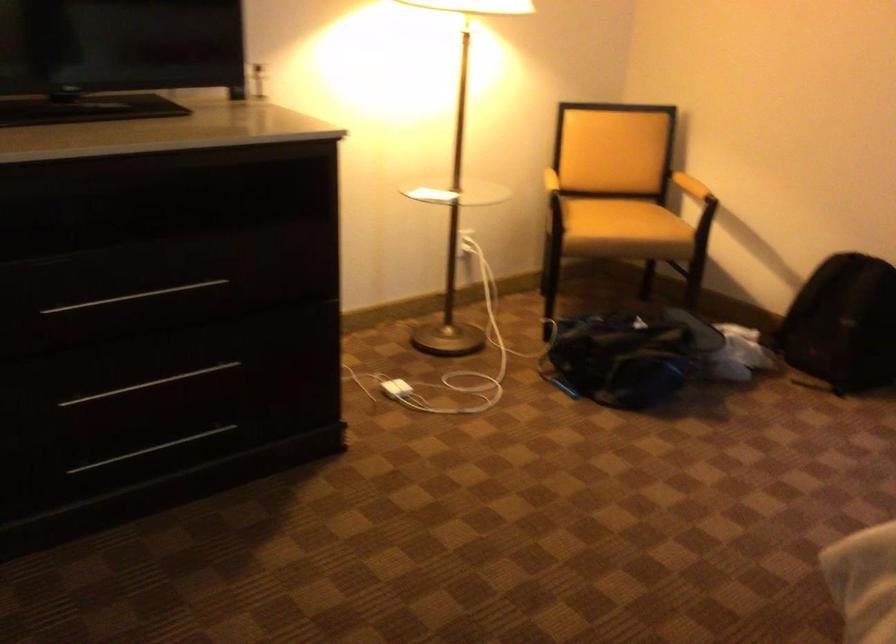
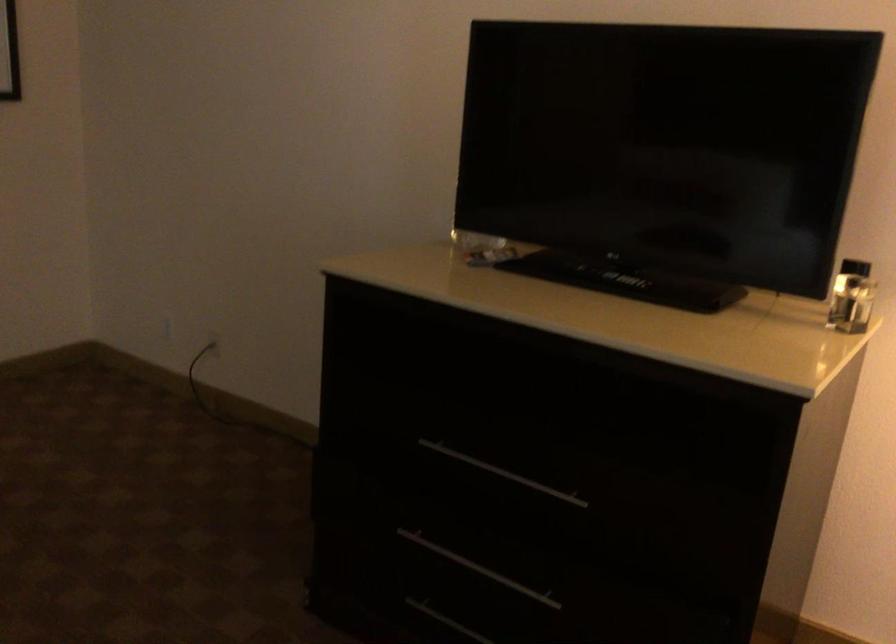
In the second image, find the point that corresponds to the point at 91,469 in the first image.

(446, 621)